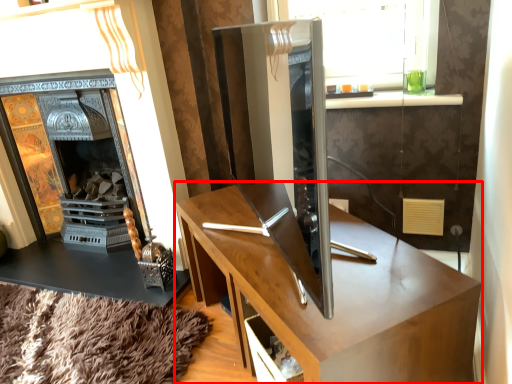
Question: Where is desk (annotated by the red box) located in relation to fireplace in the image?

Choices:
 (A) right
 (B) left

Answer: (A)